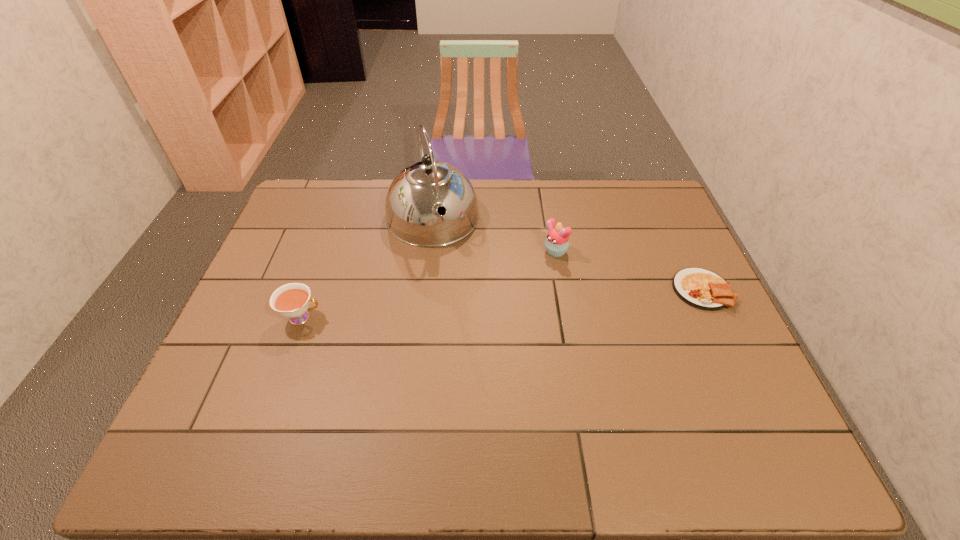
Where is `the third tallest object`? the third tallest object is located at coordinates (291, 300).

What are the coordinates of `teacup` in the screenshot? It's located at (291, 300).

Identify the location of the shortest object. Image resolution: width=960 pixels, height=540 pixels. (700, 288).

Identify the location of omelet. This screenshot has width=960, height=540. (700, 288).

Identify the location of kettle. (412, 201).

Image resolution: width=960 pixels, height=540 pixels. What are the coordinates of `the third object from right to left` in the screenshot? It's located at (412, 201).

At what (x,y) coordinates should I click in order to perform the action: click on the third object from left to right. Please return your answer as a coordinate pair (x, y). Looking at the image, I should click on (557, 241).

Identify the location of cupcake. (557, 241).

In order to click on vacant position located 0.340m on the side of the third tallest object with the handle in this screenshot , I will do `click(452, 318)`.

This screenshot has width=960, height=540. What are the coordinates of `free space located 0.390m on the back of the rightmost object` in the screenshot? It's located at (656, 192).